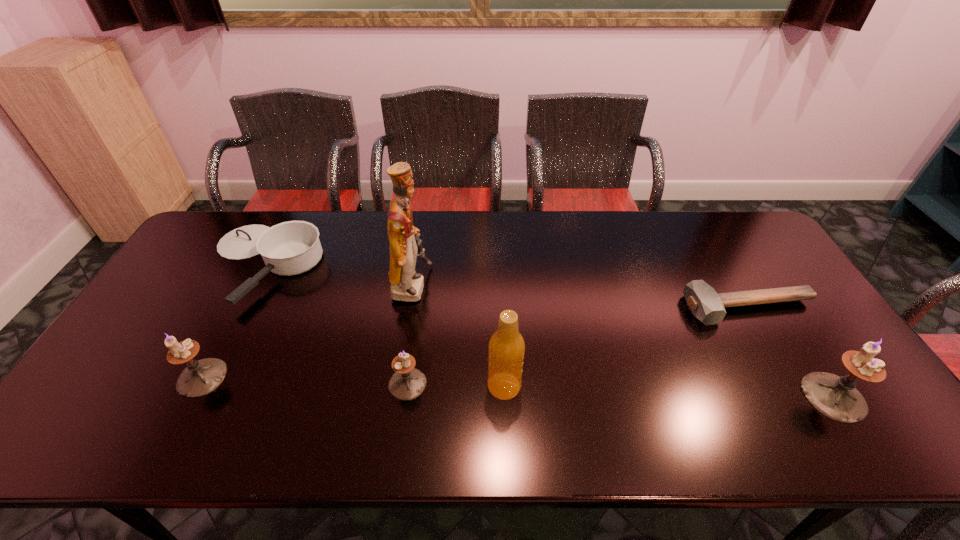
Where is `the leftmost candle holder`? the leftmost candle holder is located at coordinates (199, 378).

Find the location of a particular element. the second shortest candle holder is located at coordinates 199,378.

Locate an element on the screen. The height and width of the screenshot is (540, 960). the third shortest object is located at coordinates (407, 383).

The image size is (960, 540). I want to click on the shortest candle holder, so click(407, 383).

Find the location of a particular element. the third tallest object is located at coordinates (835, 397).

This screenshot has width=960, height=540. Find the location of `the tallest candle holder`. the tallest candle holder is located at coordinates (835, 397).

The width and height of the screenshot is (960, 540). I want to click on nutcracker, so click(406, 285).

Find the location of a particular element. The width and height of the screenshot is (960, 540). saucepan is located at coordinates pyautogui.click(x=289, y=248).

You are a GUI agent. You are given a task and a screenshot of the screen. Output one action in this format:
    pyautogui.click(x=<x>, y=<y>)
    Task: Click on the shortest object
    The height and width of the screenshot is (540, 960).
    Given the screenshot: What is the action you would take?
    pyautogui.click(x=706, y=305)

Locate an element on the screen. This screenshot has height=540, width=960. the sixth shortest object is located at coordinates point(506,349).